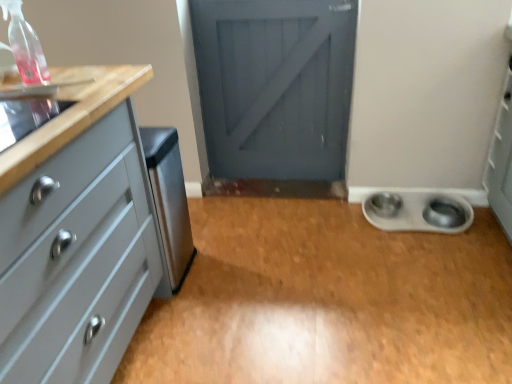
Question: Relative to matte gray chest of drawers at left, is metallic silver bowls at lower right in front or behind?

Choices:
 (A) behind
 (B) front

Answer: (A)

Question: Visually, is metallic silver bowls at lower right positioned to the left or to the right of matte gray chest of drawers at left?

Choices:
 (A) right
 (B) left

Answer: (A)

Question: Considering the real-world distances, which object is closest to the clear plastic spray bottle at upper left?

Choices:
 (A) stainless steel trash can at left, which is the 1th appliance from left to right
 (B) metallic silver bowl at lower right
 (C) matte gray chest of drawers at left
 (D) silver metallic bowls at lower right, which is the 1th appliance from back to front
 (E) metallic silver bowls at lower right

Answer: (C)

Question: Estimate the real-world distances between objects in this image. Which object is closer to the stainless steel trash can at left, the 2th appliance viewed from the right?

Choices:
 (A) silver metallic bowls at lower right, which is the 1th appliance from back to front
 (B) metallic silver bowl at lower right
 (C) metallic silver bowls at lower right
 (D) matte gray chest of drawers at left
 (E) clear plastic spray bottle at upper left

Answer: (D)